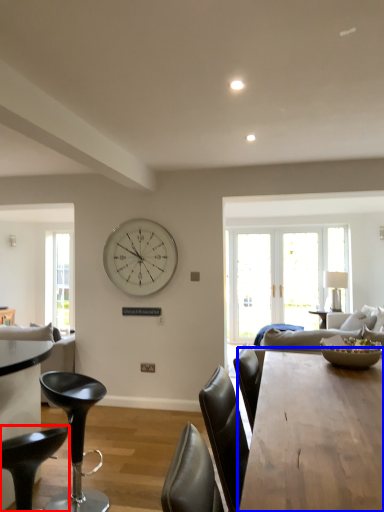
Question: Which of the following is the farthest to the observer, chair (highlighted by a red box) or kitchen & dining room table (highlighted by a blue box)?

Choices:
 (A) chair
 (B) kitchen & dining room table

Answer: (A)